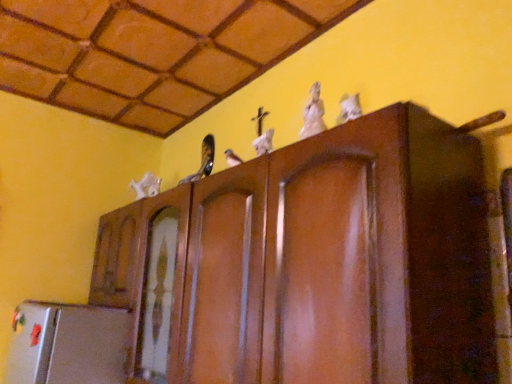
Question: In terms of size, does white matte animal at left, placed as the third animal when sorted from right to left, appear bigger or smaller than white glossy cat at upper right, the 1th animal viewed from the front?

Choices:
 (A) big
 (B) small

Answer: (A)

Question: From a real-world perspective, is white matte animal at left, which is counted as the first animal, starting from the back, above or below white glossy cat at upper right, which is counted as the first animal, starting from the right?

Choices:
 (A) below
 (B) above

Answer: (B)

Question: Considering the real-world distances, which object is closest to the white glossy statue at upper center, the second animal in the left-to-right sequence?

Choices:
 (A) white matte animal at left, the third animal in the front-to-back sequence
 (B) white glossy cat at upper right, the third animal viewed from the left

Answer: (B)

Question: Which is farther from the white glossy statue at upper center, placed as the 2th animal when sorted from front to back?

Choices:
 (A) white matte animal at left, the third animal in the front-to-back sequence
 (B) white glossy cat at upper right, acting as the third animal starting from the back

Answer: (A)